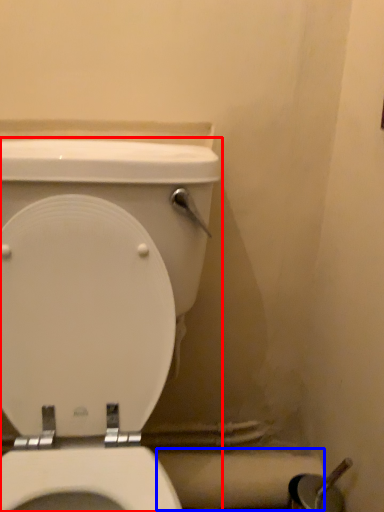
Question: Which object is closer to the camera taking this photo, toilet (highlighted by a red box) or toilet paper (highlighted by a blue box)?

Choices:
 (A) toilet
 (B) toilet paper

Answer: (A)